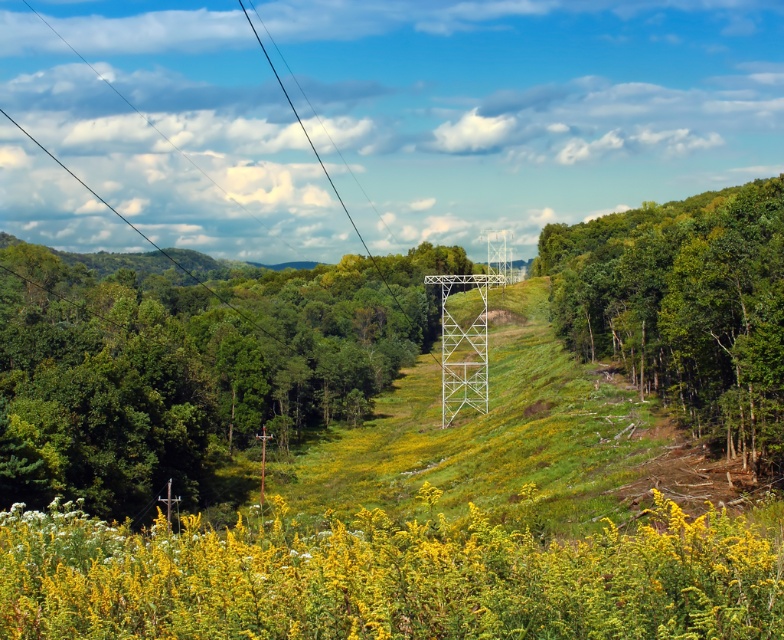
You are standing in the vibrant natural landscape scene. You see two points marked in the image. Which point is closer to you, point 1 at coordinates (590, 280) or point 2 at coordinates (360, 241)?

Point 1 at coordinates (590, 280) is closer to the viewer than point 2 at coordinates (360, 241).

You are standing at the camera position looking at the landscape. There is a point marked at coordinates (579, 621) in the image. If you want to place a 3 meter wide banner exactly at that point, will it fit without overlapping any nearby objects?

The point at (579, 621) is 5.84 meters away from the camera. Since the banner is 3 meters wide, it can be placed there without overlapping nearby objects as long as there is sufficient space horizontally at that distance. However, the scene description mentions a wire running diagonally across the scene and a transmission tower in the middle ground, so you should check for any obstructions at that specific location.